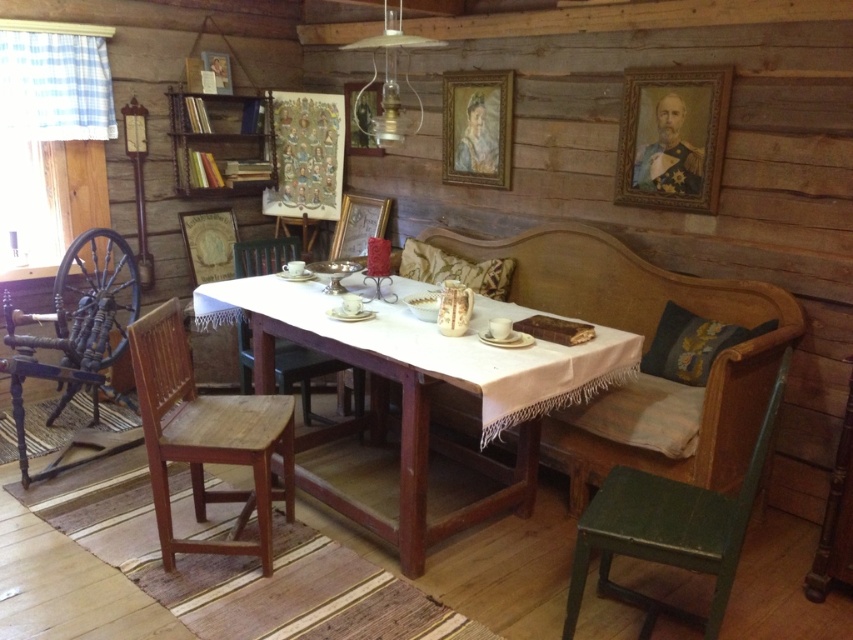
Question: Which point is closer to the camera taking this photo?

Choices:
 (A) (55, 380)
 (B) (662, 356)
 (C) (279, 252)

Answer: (B)

Question: Observing the image, what is the correct spatial positioning of wooden table at center in reference to velvet cushion at center?

Choices:
 (A) right
 (B) left

Answer: (B)

Question: Which object is the closest to the green wooden chair at lower right?

Choices:
 (A) wooden chair at lower left
 (B) wooden chair at center

Answer: (A)

Question: Is wooden chair at center thinner than velvet cushion at center?

Choices:
 (A) yes
 (B) no

Answer: (B)

Question: Does embroidered fabric pillow at right have a smaller size compared to velvet cushion at center?

Choices:
 (A) yes
 (B) no

Answer: (A)

Question: Which is nearer to the wooden chair at center?

Choices:
 (A) wooden spool at left
 (B) velvet cushion at center
 (C) wooden chair at lower left
 (D) green wooden chair at lower right

Answer: (C)